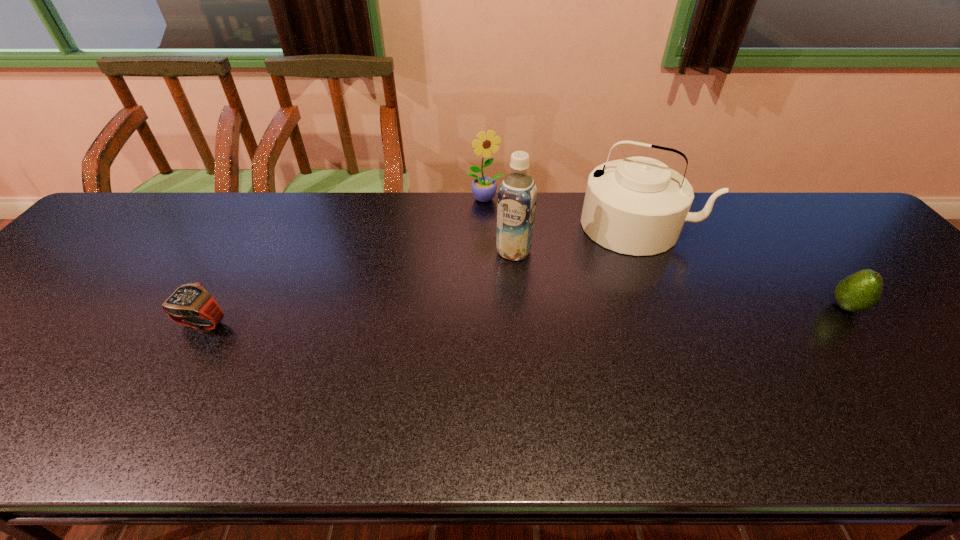
The image size is (960, 540). I want to click on the leftmost object, so click(191, 305).

Where is `the shortest object`? Image resolution: width=960 pixels, height=540 pixels. the shortest object is located at coordinates (191, 305).

I want to click on avocado, so click(860, 291).

This screenshot has height=540, width=960. What are the coordinates of `the rightmost object` in the screenshot? It's located at (860, 291).

At what (x,y) coordinates should I click in order to perform the action: click on sunflower. Please return your answer as a coordinate pair (x, y). This screenshot has height=540, width=960. Looking at the image, I should click on click(x=484, y=188).

This screenshot has width=960, height=540. Identify the location of soya milk. (517, 195).

At what (x,y) coordinates should I click in order to perform the action: click on the second object from right to left. Please return your answer as a coordinate pair (x, y). Looking at the image, I should click on (637, 206).

Locate an element on the screen. This screenshot has width=960, height=540. vacant space located on the right of the shortest object is located at coordinates (276, 322).

Where is `vacant space located on the back of the second shortest object`? vacant space located on the back of the second shortest object is located at coordinates (793, 241).

What are the coordinates of `vacant space located 0.310m on the front-facing side of the sunflower` in the screenshot? It's located at (522, 272).